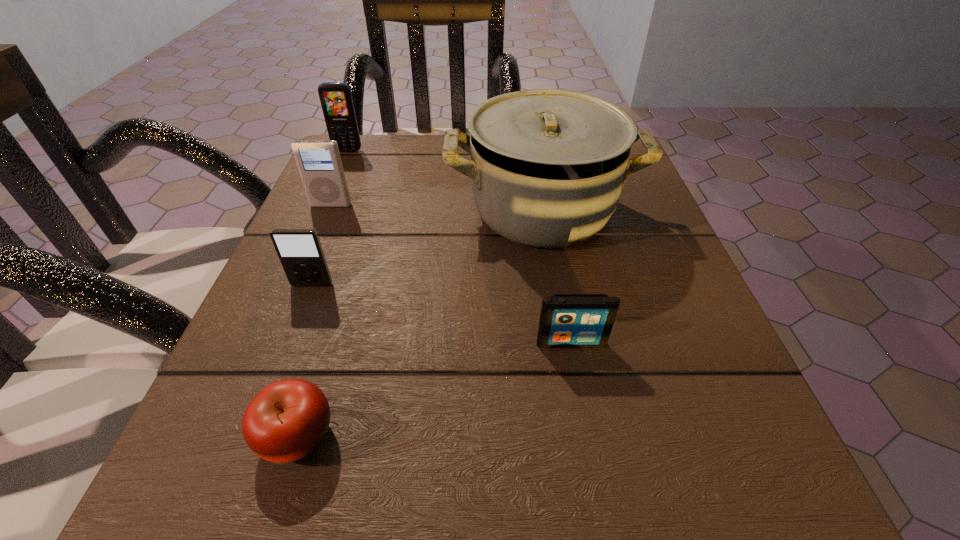
At what (x,y) coordinates should I click in order to perform the action: click on vacant area at the near left corner. Please return your answer as a coordinate pair (x, y). Looking at the image, I should click on (249, 450).

This screenshot has height=540, width=960. What are the coordinates of `vacant region at the near right corner of the desktop` in the screenshot? It's located at (734, 471).

Where is `empty space that is in between the second nearest iPod and the tallest object`? Image resolution: width=960 pixels, height=540 pixels. empty space that is in between the second nearest iPod and the tallest object is located at coordinates (427, 248).

The width and height of the screenshot is (960, 540). Identify the location of empty space that is in between the shortest iPod and the cellular telephone. (460, 247).

Identify the location of free space between the second nearest object and the tallest iPod. This screenshot has height=540, width=960. (451, 274).

The height and width of the screenshot is (540, 960). I want to click on free space between the shortest iPod and the third nearest object, so click(x=442, y=314).

Where is `unoccupied position between the nearest object and the saucepan`? This screenshot has width=960, height=540. unoccupied position between the nearest object and the saucepan is located at coordinates (420, 323).

The width and height of the screenshot is (960, 540). What are the coordinates of `free point between the fifth farthest object and the farthest iPod` in the screenshot? It's located at (451, 274).

At what (x,y) coordinates should I click in order to perform the action: click on vacant area that lies between the saucepan and the third nearest object. Please return your answer as a coordinate pair (x, y). The image size is (960, 540). Looking at the image, I should click on (427, 248).

Where is `free space between the apple and the farthest iPod`? The height and width of the screenshot is (540, 960). free space between the apple and the farthest iPod is located at coordinates (315, 321).